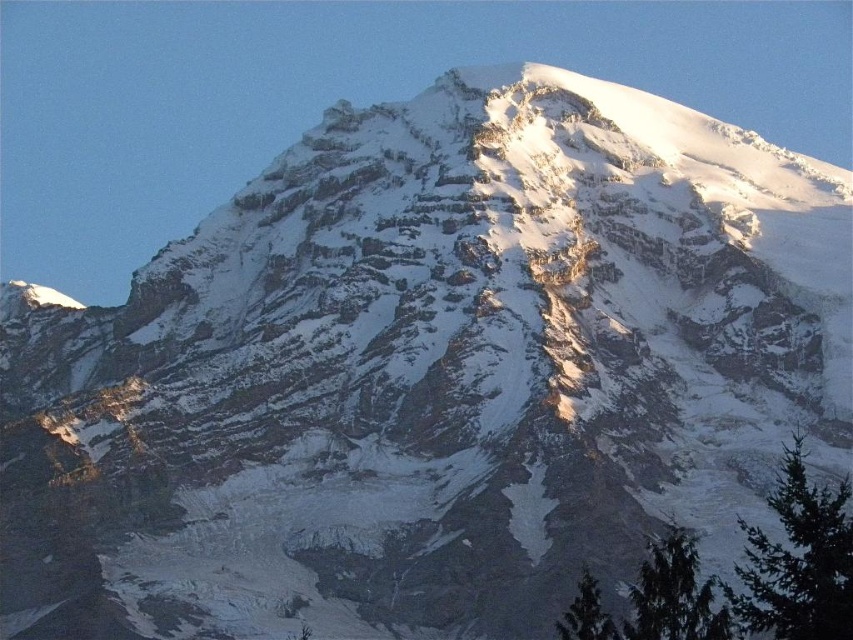
Who is lower down, green textured evergreen at lower right or green textured tree at lower right?

green textured tree at lower right

Image resolution: width=853 pixels, height=640 pixels. In order to click on green textured evergreen at lower right in this screenshot , I will do `click(798, 561)`.

Which is in front, point (824, 509) or point (654, 621)?

Positioned in front is point (654, 621).

Is green textured evergreen at lower right behind green matte tree at lower right?

No, green textured evergreen at lower right is in front of green matte tree at lower right.

Where is `green textured evergreen at lower right`? The height and width of the screenshot is (640, 853). green textured evergreen at lower right is located at coordinates (798, 561).

Locate an element on the screen. The image size is (853, 640). green textured evergreen at lower right is located at coordinates (798, 561).

Does green matte tree at lower right have a smaller size compared to green textured tree at lower right?

No, green matte tree at lower right is not smaller than green textured tree at lower right.

The height and width of the screenshot is (640, 853). Find the location of `green matte tree at lower right`. green matte tree at lower right is located at coordinates (674, 595).